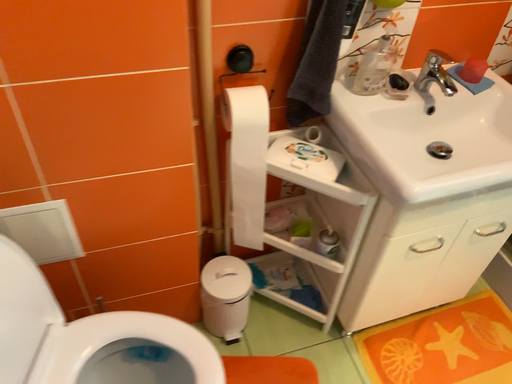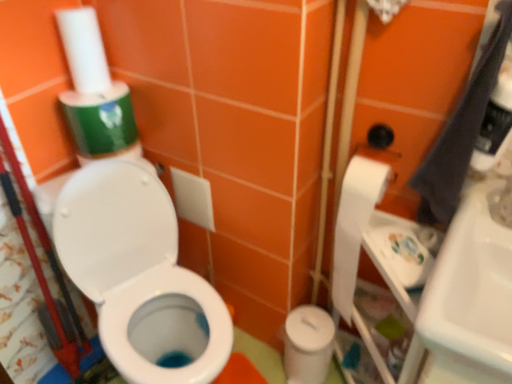
Question: How did the camera likely rotate when shooting the video?

Choices:
 (A) rotated downward
 (B) rotated upward

Answer: (B)